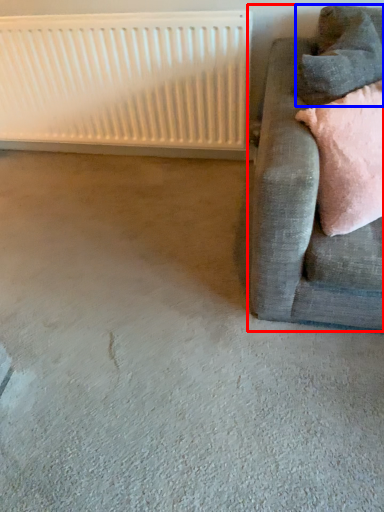
Question: Among these objects, which one is nearest to the camera, studio couch (highlighted by a red box) or pillow (highlighted by a blue box)?

Choices:
 (A) studio couch
 (B) pillow

Answer: (A)